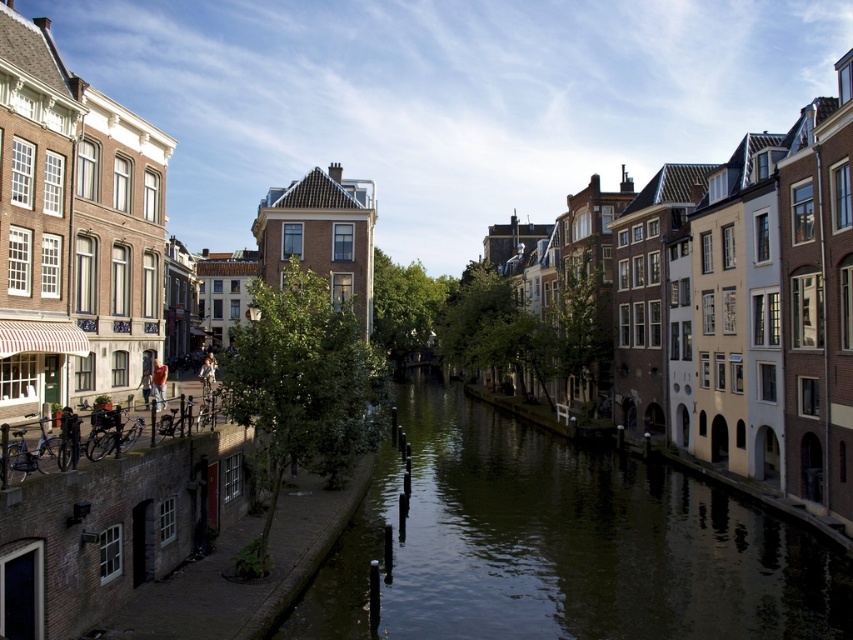
Is greenish water at center to the left of light brown leather jacket at left from the viewer's perspective?

In fact, greenish water at center is to the right of light brown leather jacket at left.

Is greenish water at center shorter than light brown leather jacket at left?

Yes.

Locate an element on the screen. greenish water at center is located at coordinates (561, 545).

Find the location of a particular element. The height and width of the screenshot is (640, 853). greenish water at center is located at coordinates (561, 545).